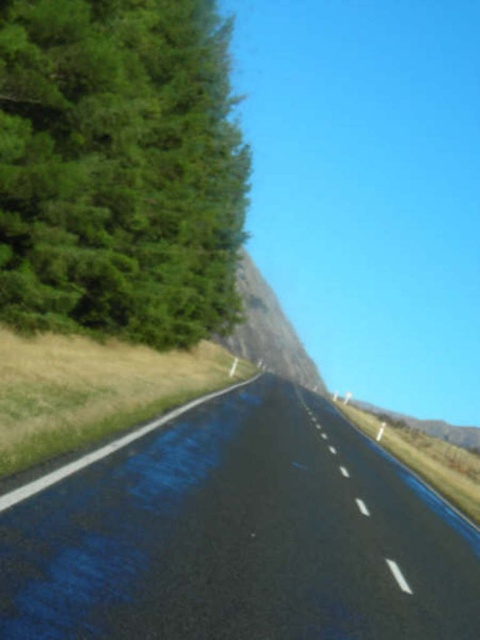
Question: Is black asphalt road at center thinner than green leafy tree at left?

Choices:
 (A) no
 (B) yes

Answer: (A)

Question: Which object is closer to the camera taking this photo?

Choices:
 (A) green leafy tree at left
 (B) black asphalt road at center

Answer: (B)

Question: Can you confirm if black asphalt road at center is positioned to the right of green leafy tree at left?

Choices:
 (A) no
 (B) yes

Answer: (B)

Question: Which point is farther to the camera?

Choices:
 (A) green leafy tree at left
 (B) black asphalt road at center

Answer: (A)

Question: Does black asphalt road at center have a lesser width compared to green leafy tree at left?

Choices:
 (A) no
 (B) yes

Answer: (A)